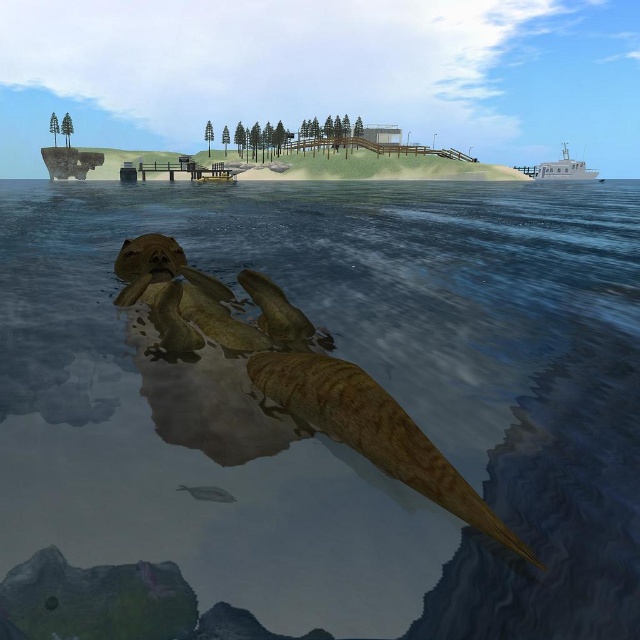
You are a marine biologist observing the coastal scene from underwater. You notice the brown textured water at center and the white matte boat at upper right. Which object is closer to your current position?

The brown textured water at center is closer to your current position because it is in front of the white matte boat at upper right.

You are a marine biologist observing the coastal scene. You need to determine which object occupies more space in the image between the brown textured water at center and the white matte boat at upper right. Based on the scene, which one is larger?

The brown textured water at center is bigger than the white matte boat at upper right, so it occupies more space in the image.

You are a marine biologist observing the scene from underwater. You notice the brown textured water at center and the white matte boat at upper right. Which object appears closer to the surface?

The white matte boat at upper right appears closer to the surface because it has a greater height compared to the brown textured water at center.